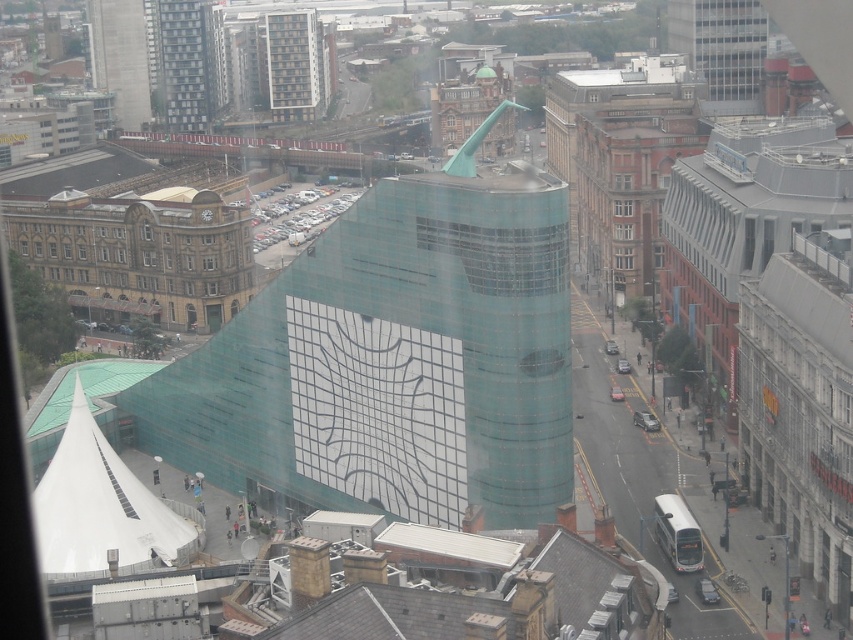
You are a drone operator who needs to fly a drone from the glassy teal building at upper left to the nearest building with a red brick facade. How far will the drone have to travel?

The distance between the glassy teal building at upper left and the nearest building with a red brick facade is 398.21 meters, so the drone will have to travel 398.21 meters.

You are an architect analyzing the urban layout. From your vantage point, which object is positioned to the left of the other between the glassy teal building at upper left and the transparent glass window at upper center?

The glassy teal building at upper left is positioned to the left of the transparent glass window at upper center.

You are an architect analyzing the urban skyline. You notice the glassy teal building at upper left and the transparent glass window at upper center. Which of these two elements is taller?

The glassy teal building at upper left is much taller than the transparent glass window at upper center.